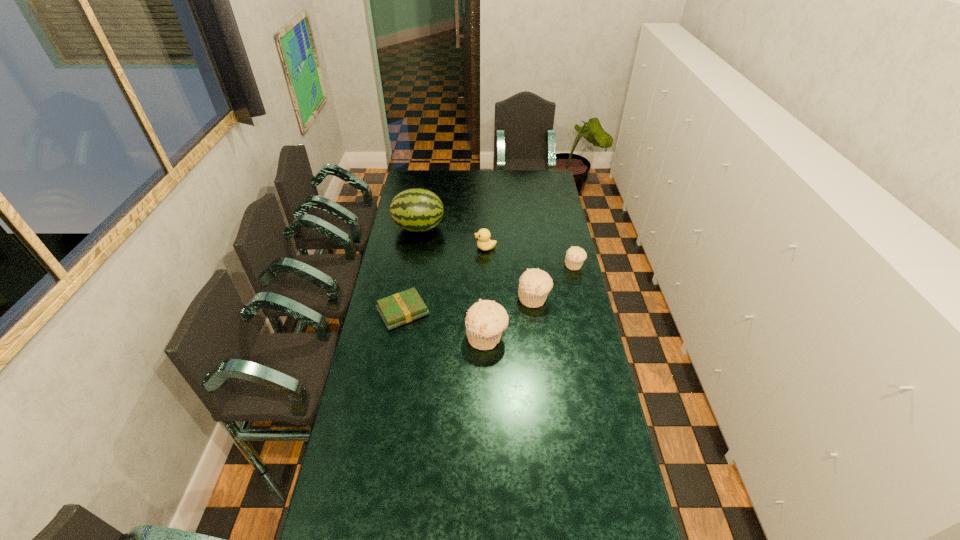
The width and height of the screenshot is (960, 540). I want to click on vacant space that satisfies the following two spatial constraints: 1. on the face of the duck; 2. on the back side of the second shortest muffin, so click(x=486, y=298).

Identify the location of free space in the image that satisfies the following two spatial constraints: 1. on the front side of the shortest object; 2. on the right side of the nearest muffin. (398, 338).

The width and height of the screenshot is (960, 540). Identify the location of free space that satisfies the following two spatial constraints: 1. on the face of the second farthest object; 2. on the right side of the second nearest muffin. (486, 298).

At what (x,y) coordinates should I click in order to perform the action: click on free spot that satisfies the following two spatial constraints: 1. at the stem end of the tallest object; 2. on the front side of the book. Please return your answer as a coordinate pair (x, y). This screenshot has width=960, height=540. Looking at the image, I should click on (405, 312).

The width and height of the screenshot is (960, 540). Identify the location of vacant space that satisfies the following two spatial constraints: 1. at the stem end of the farthest object; 2. on the left side of the nearest muffin. (400, 338).

Where is `free location that satisfies the following two spatial constraints: 1. at the stem end of the nearest muffin; 2. on the right side of the tallest object`? free location that satisfies the following two spatial constraints: 1. at the stem end of the nearest muffin; 2. on the right side of the tallest object is located at coordinates [x=400, y=338].

This screenshot has height=540, width=960. Find the location of `free location that satisfies the following two spatial constraints: 1. at the stem end of the tallest object; 2. on the back side of the second tallest muffin`. free location that satisfies the following two spatial constraints: 1. at the stem end of the tallest object; 2. on the back side of the second tallest muffin is located at coordinates (407, 298).

This screenshot has height=540, width=960. I want to click on free space that satisfies the following two spatial constraints: 1. on the face of the shortest muffin; 2. on the left side of the second farthest object, so click(x=486, y=265).

The height and width of the screenshot is (540, 960). Identify the location of free space that satisfies the following two spatial constraints: 1. at the stem end of the farthest muffin; 2. on the left side of the watermelon. (413, 265).